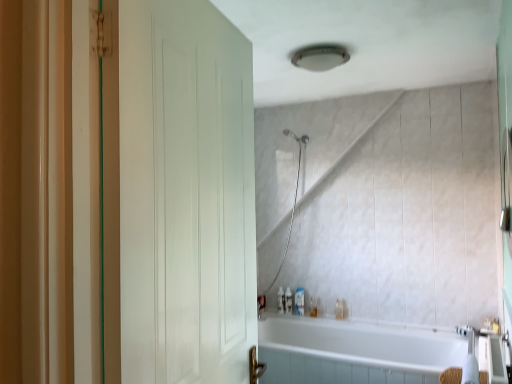
Locate an element on the screen. Image resolution: width=512 pixels, height=384 pixels. blank space to the left of translucent plastic bottle at lower center, positioned as the sixth toiletry in left-to-right order is located at coordinates 324,315.